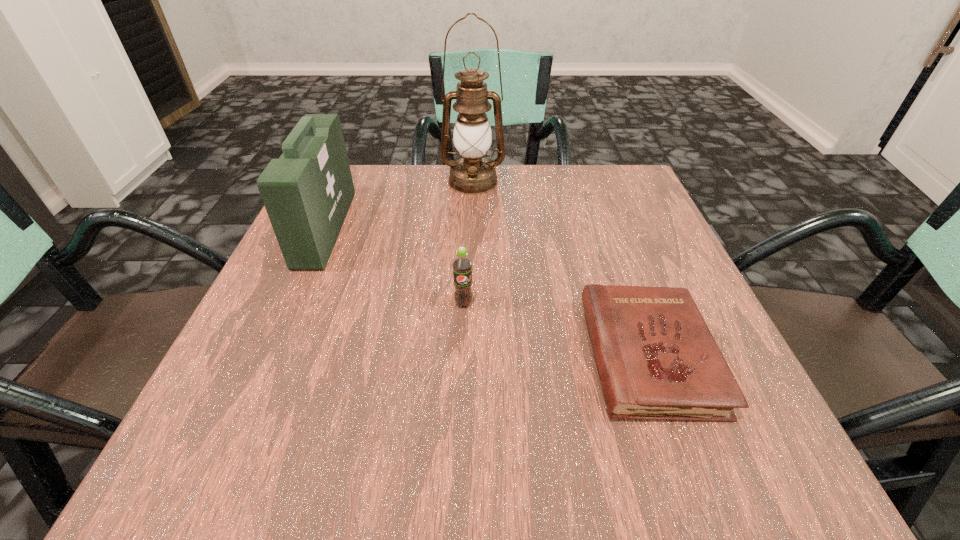
Find the location of a particular element. vacant space at the right edge is located at coordinates (761, 407).

Image resolution: width=960 pixels, height=540 pixels. What are the coordinates of `vacant position at the near left corner of the desktop` in the screenshot? It's located at (173, 459).

Find the location of `vacant space at the far right corner of the desktop`. vacant space at the far right corner of the desktop is located at coordinates (588, 165).

Identify the location of free location at the near right corner. The image size is (960, 540). (750, 480).

Locate an element on the screen. The height and width of the screenshot is (540, 960). empty space that is in between the shortest object and the oil lamp is located at coordinates coord(562,269).

This screenshot has width=960, height=540. I want to click on unoccupied area between the rightmost object and the first-aid kit, so click(488, 292).

You are a GUI agent. You are given a task and a screenshot of the screen. Output one action in this format:
    pyautogui.click(x=<x>, y=<y>)
    Task: Click on the vacant space that's between the first-aid kit and the third tallest object
    This screenshot has height=540, width=960.
    Given the screenshot: What is the action you would take?
    pyautogui.click(x=395, y=266)

The height and width of the screenshot is (540, 960). Find the location of `vacant area that lies between the rightmost object and the first-aid kit`. vacant area that lies between the rightmost object and the first-aid kit is located at coordinates (488, 292).

Where is `free point between the second tallest object and the tallest object`? free point between the second tallest object and the tallest object is located at coordinates (399, 205).

In order to click on empty location between the first-aid kit and the oil lamp in this screenshot , I will do `click(399, 205)`.